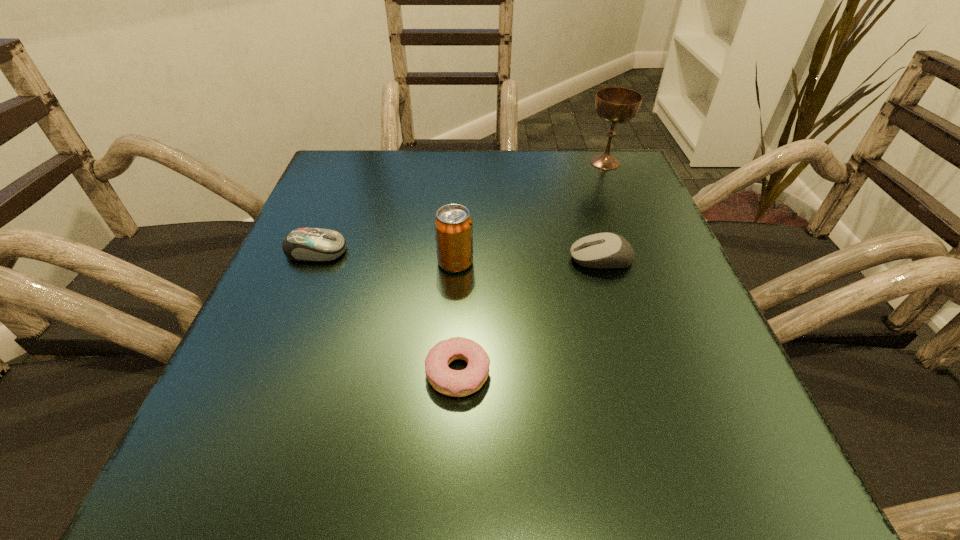
At what (x,y) coordinates should I click in order to perform the action: click on free spot that satisfies the following two spatial constraints: 1. on the front side of the chalice; 2. on the wheel side of the right computer mouse. Please return your answer as a coordinate pair (x, y). This screenshot has width=960, height=540. Looking at the image, I should click on (644, 259).